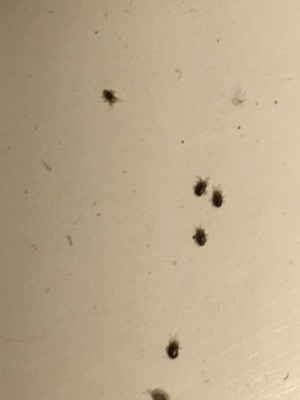
What are the coordinates of `table top` in the screenshot? It's located at (80, 155).